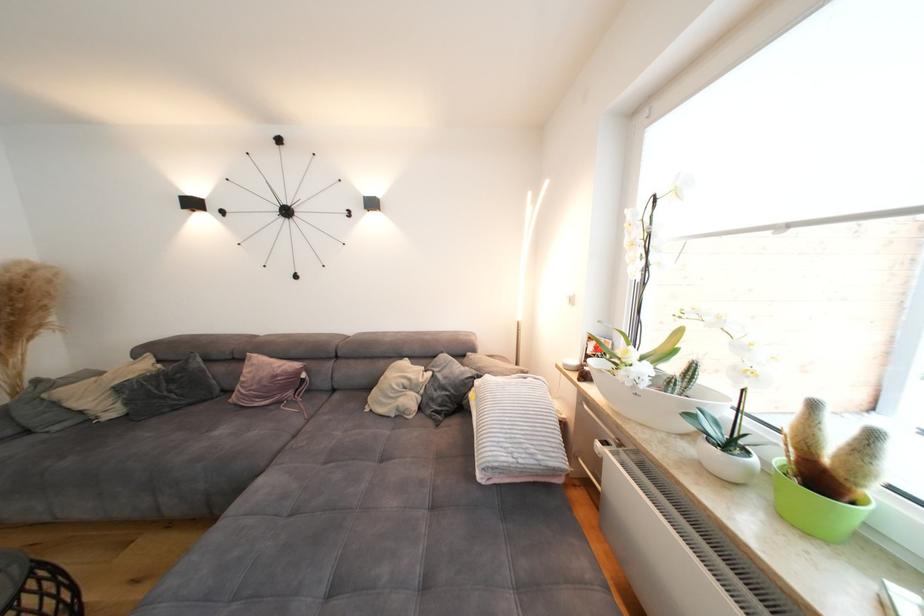
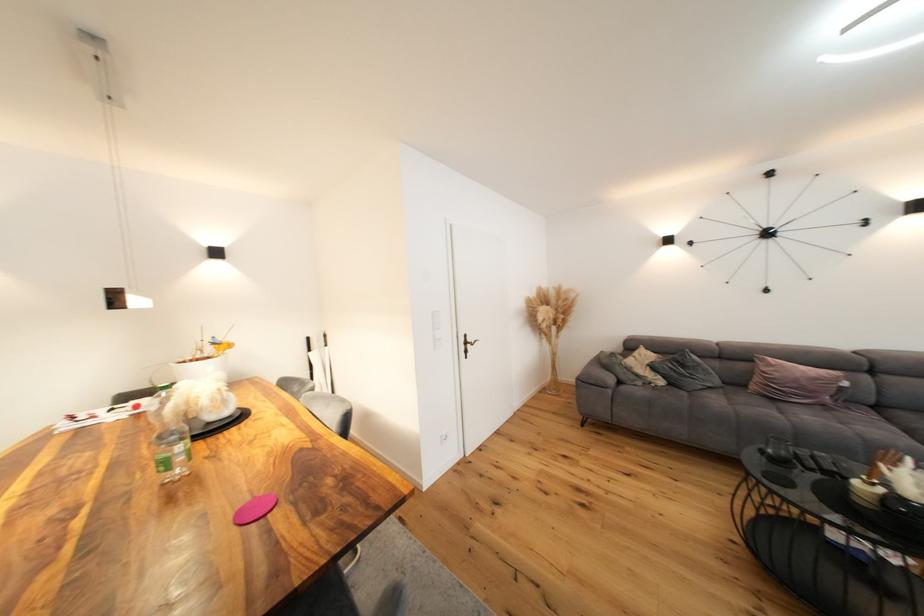
Find the pixel in the second image that matches (x=177, y=382) in the first image.

(690, 368)